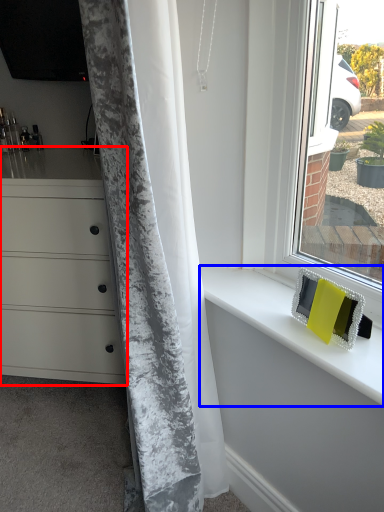
Question: Which object appears farthest to the camera in this image, chest of drawers (highlighted by a red box) or counter top (highlighted by a blue box)?

Choices:
 (A) chest of drawers
 (B) counter top

Answer: (A)